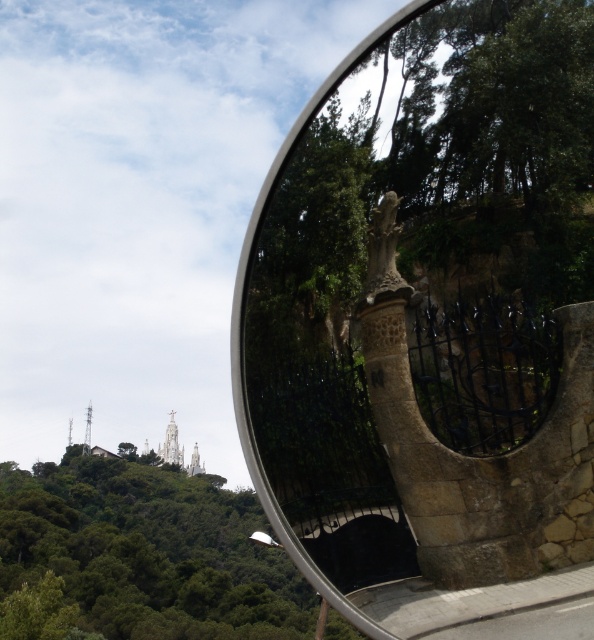
Who is taller, stone statue at center or green leafy tree at upper center?

green leafy tree at upper center

Does stone statue at center have a lesser height compared to green leafy tree at upper center?

Indeed, stone statue at center has a lesser height compared to green leafy tree at upper center.

Locate an element on the screen. The height and width of the screenshot is (640, 594). stone statue at center is located at coordinates (428, 307).

At what (x,y) coordinates should I click in order to perform the action: click on stone statue at center. Please return your answer as a coordinate pair (x, y). Image resolution: width=594 pixels, height=640 pixels. Looking at the image, I should click on (428, 307).